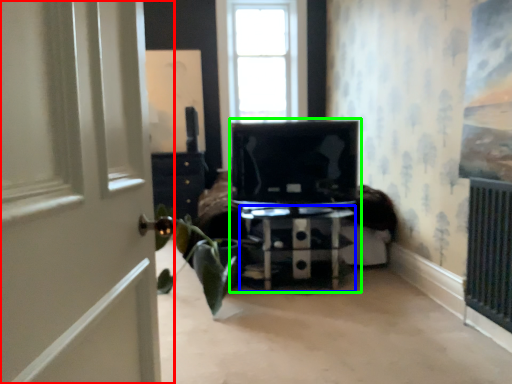
Question: Based on their relative distances, which object is nearer to door (highlighted by a red box)? Choose from furniture (highlighted by a blue box) and entertainment center (highlighted by a green box).

Choices:
 (A) furniture
 (B) entertainment center

Answer: (B)